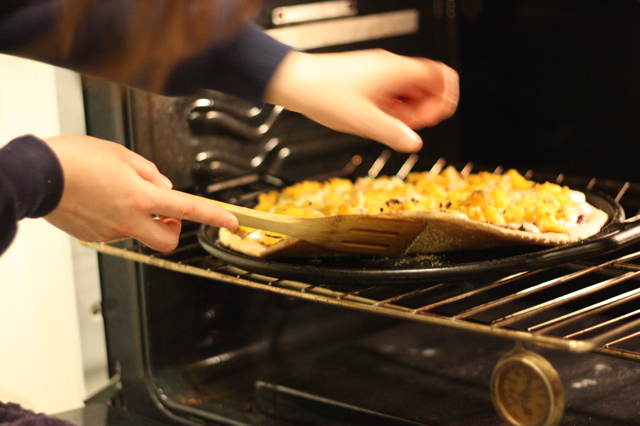
Identify the location of oven. Image resolution: width=640 pixels, height=426 pixels. (113, 111).